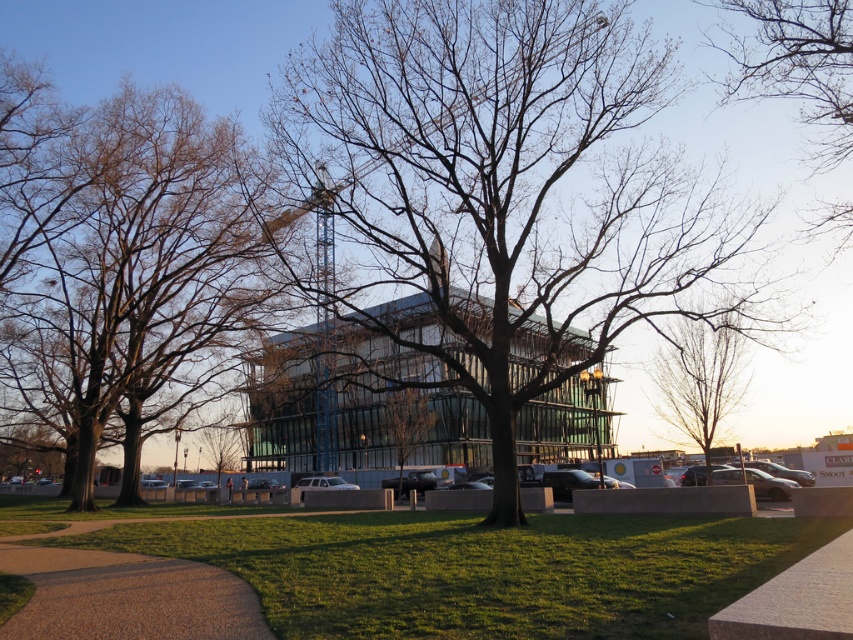
Question: Does green grass at lower center appear under bare wood tree at right?

Choices:
 (A) yes
 (B) no

Answer: (A)

Question: Among these objects, which one is nearest to the camera?

Choices:
 (A) green grass at lower center
 (B) brown smooth tree at center
 (C) bare wood tree at right
 (D) bare branches at center

Answer: (A)

Question: Which object is closer to the camera taking this photo?

Choices:
 (A) brown smooth tree at center
 (B) bare wood tree at right
 (C) bare branches at center

Answer: (C)

Question: Which point is farther from the camera taking this photo?

Choices:
 (A) (144, 349)
 (B) (457, 518)
 (C) (808, 116)
 (D) (721, 266)

Answer: (A)

Question: Can you confirm if bare branches at center is wider than brown smooth tree at center?

Choices:
 (A) no
 (B) yes

Answer: (A)

Question: Where is green grass at lower center located in relation to bare branches at upper right in the image?

Choices:
 (A) below
 (B) above

Answer: (A)